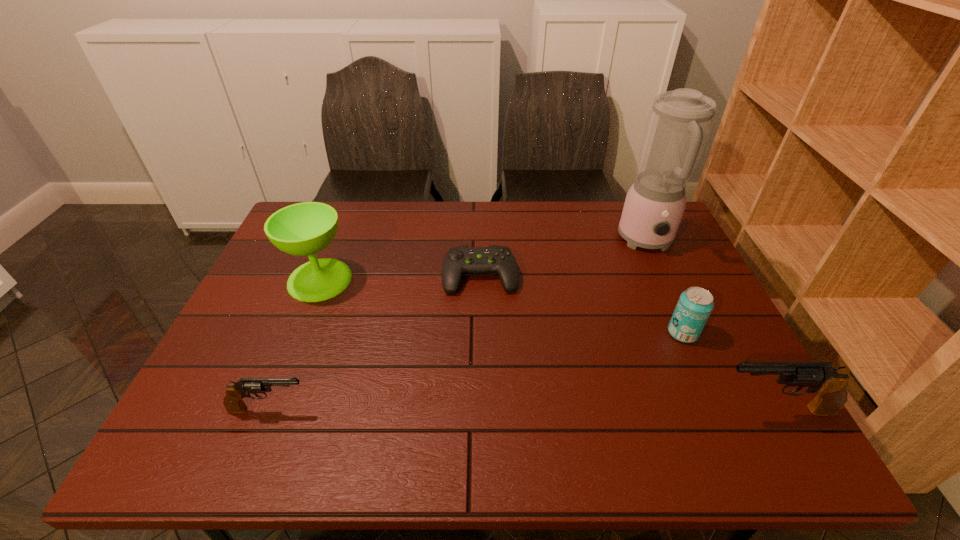
Identify which object is the second nearest to the fourth farthest object. Please provide its 2D coordinates. Your answer should be formatted as a tuple, i.e. [(x, y)], where the tuple contains the x and y coordinates of a point satisfying the conditions above.

[(679, 122)]

Identify the location of vacant point that satisfies the following two spatial constraints: 1. on the front side of the shortest object; 2. along the barrel of the shorter gun. This screenshot has height=540, width=960. (480, 409).

Where is `vacant point that satisfies the following two spatial constraints: 1. along the barrel of the fourth shortest object; 2. along the barrel of the fifth tallest object`? The width and height of the screenshot is (960, 540). vacant point that satisfies the following two spatial constraints: 1. along the barrel of the fourth shortest object; 2. along the barrel of the fifth tallest object is located at coordinates (774, 409).

At what (x,y) coordinates should I click in order to perform the action: click on blank area in the image that satisfies the following two spatial constraints: 1. along the barrel of the right gun; 2. on the base of the tallest object near the control knob. Please return your answer as a coordinate pair (x, y). The height and width of the screenshot is (540, 960). Looking at the image, I should click on (681, 241).

Locate an element on the screen. Image resolution: width=960 pixels, height=540 pixels. free point that satisfies the following two spatial constraints: 1. on the base of the food processor near the control knob; 2. along the barrel of the right gun is located at coordinates coord(725,410).

Where is `free spot that satisfies the following two spatial constraints: 1. on the front side of the third object from left to right; 2. along the barrel of the fifth tallest object`? free spot that satisfies the following two spatial constraints: 1. on the front side of the third object from left to right; 2. along the barrel of the fifth tallest object is located at coordinates (480, 409).

At what (x,y) coordinates should I click in order to perform the action: click on vacant position in the image that satisfies the following two spatial constraints: 1. on the base of the tallest object near the control knob; 2. along the barrel of the taller gun. Please return your answer as a coordinate pair (x, y). Image resolution: width=960 pixels, height=540 pixels. Looking at the image, I should click on (725, 410).